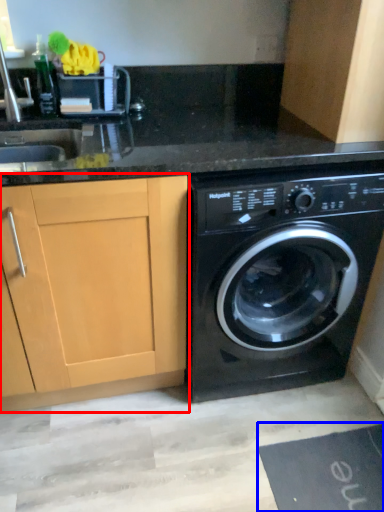
Question: Which of the following is the farthest to the observer, cabinetry (highlighted by a red box) or bath mat (highlighted by a blue box)?

Choices:
 (A) cabinetry
 (B) bath mat

Answer: (B)